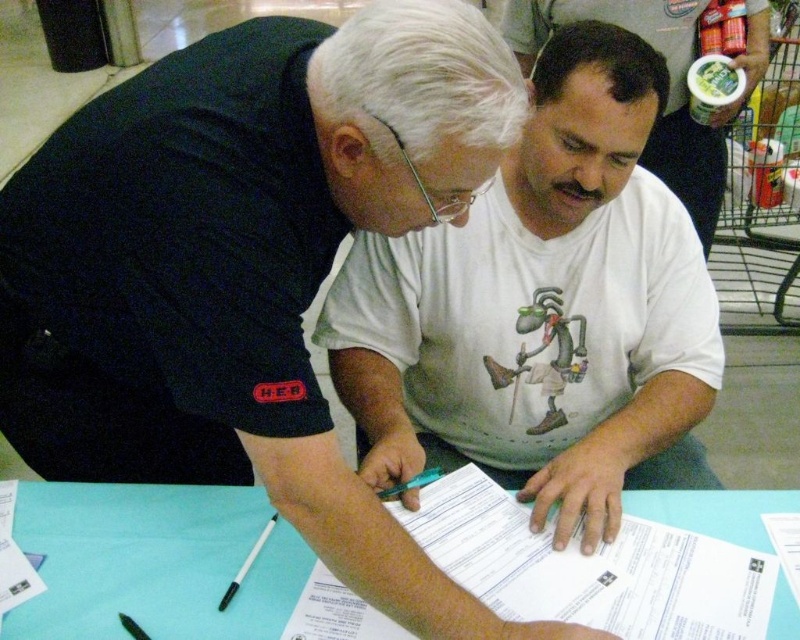
You are a customer trying to sign a document. You see the light blue paper at center and the black plastic pen at lower center. Which object should you pick up first to start signing?

You should pick up the black plastic pen at lower center first because it is needed to sign the light blue paper at center.

You are a customer trying to sign a document at the table. The light blue paper at center is where you need to sign. Can you reach it from your current position at point A, which is at coordinates 0.750, 0.250?

The light blue paper at center is located at point (154, 563). Since your current position is at (200, 480), you can reach it by moving closer to the table.

You are a customer at a store and see two points marked on the table. The first point is labeled as point (612, 54) and the second is point (254, 634). The store employee is pointing at the first point. Which point is closer to you as you face the table?

Point (612, 54) is behind point (254, 634), so the point closer to you as you face the table is point (254, 634).